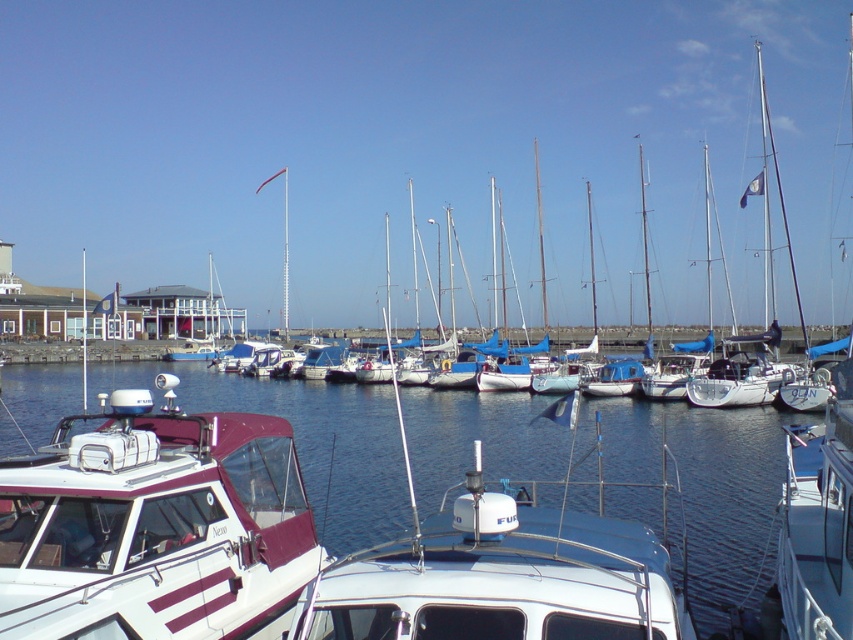
Question: Does clear water at center appear on the right side of white glossy boat at center?

Choices:
 (A) no
 (B) yes

Answer: (A)

Question: Can you confirm if clear water at center is thinner than maroon matte boat at lower left?

Choices:
 (A) no
 (B) yes

Answer: (A)

Question: Which of the following is the farthest from the observer?

Choices:
 (A) (73, 609)
 (B) (643, 406)
 (C) (662, 586)

Answer: (B)

Question: Which of these objects is positioned farthest from the white glossy boat at center?

Choices:
 (A) clear water at center
 (B) maroon matte boat at lower left

Answer: (A)

Question: Which of the following is the closest to the observer?

Choices:
 (A) clear water at center
 (B) maroon matte boat at lower left
 (C) white glossy boat at center

Answer: (C)

Question: From the image, what is the correct spatial relationship of clear water at center in relation to white glossy boat at center?

Choices:
 (A) left
 (B) right

Answer: (A)